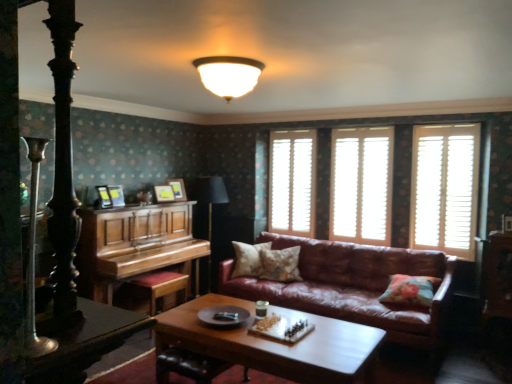
This screenshot has height=384, width=512. What do you see at coordinates (276, 343) in the screenshot?
I see `wooden chessboard at center` at bounding box center [276, 343].

The image size is (512, 384). What do you see at coordinates (410, 290) in the screenshot?
I see `floral fabric cushion at right, which is the 1th pillow from front to back` at bounding box center [410, 290].

What is the approximate width of fluffy beige pillow at center, which ranks as the 2th pillow in right-to-left order?

The width of fluffy beige pillow at center, which ranks as the 2th pillow in right-to-left order, is 13.66 inches.

Where is `fluffy beige pillow at center, the second pillow when ordered from back to front`? This screenshot has width=512, height=384. fluffy beige pillow at center, the second pillow when ordered from back to front is located at coordinates (280, 264).

This screenshot has height=384, width=512. What do you see at coordinates (135, 246) in the screenshot? I see `polished wood piano at left` at bounding box center [135, 246].

Measure the distance between polished wood piano at left and camera.

The depth of polished wood piano at left is 11.79 feet.

Where is `white wooden shutters at center, the second window from the right`? white wooden shutters at center, the second window from the right is located at coordinates (361, 185).

Measure the distance between point (293, 180) and camera.

Point (293, 180) and camera are 5.38 meters apart from each other.

Identify the location of wooden chessboard at center. This screenshot has width=512, height=384. (276, 343).

Which is behind, white wooden shutters at right, the 3th window positioned from the back, or polished wood piano at left?

white wooden shutters at right, the 3th window positioned from the back, is behind.

Who is shorter, white wooden shutters at right, marked as the 1th window in a front-to-back arrangement, or polished wood piano at left?

Standing shorter between the two is polished wood piano at left.

Would you say white wooden shutters at right, the 3th window positioned from the back, is outside polished wood piano at left?

That's correct, white wooden shutters at right, the 3th window positioned from the back, is outside of polished wood piano at left.

Is white wooden shutters at right, which is the 3th window in left-to-right order, facing towards polished wood piano at left?

No, white wooden shutters at right, which is the 3th window in left-to-right order, does not turn towards polished wood piano at left.

Does polished wood piano at left have a greater width compared to wooden picture frame at upper center, which is the second picture frame from back to front?

Yes, polished wood piano at left is wider than wooden picture frame at upper center, which is the second picture frame from back to front.

Does polished wood piano at left turn towards wooden picture frame at upper center, arranged as the second picture frame when viewed from the left?

No, polished wood piano at left is not turned towards wooden picture frame at upper center, arranged as the second picture frame when viewed from the left.

Locate an element on the screen. The width and height of the screenshot is (512, 384). piano on the left of wooden picture frame at upper center, which is the second picture frame in front-to-back order is located at coordinates (135, 246).

From the image's perspective, which one is positioned higher, white wooden shutters at center, positioned as the second window in left-to-right order, or leather at center?

white wooden shutters at center, positioned as the second window in left-to-right order.

Does white wooden shutters at center, placed as the second window when sorted from front to back, have a larger size compared to leather at center?

Correct, white wooden shutters at center, placed as the second window when sorted from front to back, is larger in size than leather at center.

At what (x,y) coordinates should I click in order to perform the action: click on window that is the 2nd object located above the leather at center (from the image's perspective). Please return your answer as a coordinate pair (x, y). Looking at the image, I should click on (361, 185).

Is white wooden shutters at center, the second window from the right, positioned far away from leather at center?

Absolutely, white wooden shutters at center, the second window from the right, is distant from leather at center.

From the image's perspective, is wooden at left beneath wooden chessboard at center?

Incorrect, from the image's perspective, wooden at left is higher than wooden chessboard at center.

Measure the distance from wooden at left to wooden chessboard at center.

wooden at left and wooden chessboard at center are 1.40 meters apart.

Who is smaller, wooden at left or wooden chessboard at center?

wooden at left.

Can you confirm if fluffy beige pillow at center, which ranks as the 2th pillow in right-to-left order, is bigger than wooden picture frame at upper center, the first picture frame when ordered from right to left?

Yes.

Who is shorter, fluffy beige pillow at center, the second pillow positioned from the left, or wooden picture frame at upper center, positioned as the third picture frame in front-to-back order?

wooden picture frame at upper center, positioned as the third picture frame in front-to-back order, is shorter.

From a real-world perspective, is fluffy beige pillow at center, the second pillow positioned from the left, physically above wooden picture frame at upper center, positioned as the third picture frame in front-to-back order?

No, from a real-world perspective, fluffy beige pillow at center, the second pillow positioned from the left, is not over wooden picture frame at upper center, positioned as the third picture frame in front-to-back order

Does point (276, 275) lie behind point (180, 200)?

That is False.

Is black fabric lamp at center wider than leather couch at center?

No.

Is black fabric lamp at center outside of leather couch at center?

black fabric lamp at center lies outside leather couch at center's area.

Is black fabric lamp at center oriented away from leather couch at center?

No, black fabric lamp at center is not facing the opposite direction of leather couch at center.

Would you say black fabric lamp at center is to the left or to the right of leather couch at center in the picture?

Clearly, black fabric lamp at center is on the left of leather couch at center in the image.

Is there a large distance between wooden picture frame at upper center, which ranks as the 2th picture frame in right-to-left order, and floral fabric pillow at center, which is counted as the third pillow, starting from the right?

wooden picture frame at upper center, which ranks as the 2th picture frame in right-to-left order, is far away from floral fabric pillow at center, which is counted as the third pillow, starting from the right.

In the scene shown: From a real-world perspective, which is physically below, wooden picture frame at upper center, which is the second picture frame from back to front, or floral fabric pillow at center, which is the third pillow from front to back?

From a 3D spatial view, floral fabric pillow at center, which is the third pillow from front to back, is below.

From the image's perspective, relative to floral fabric pillow at center, the 1th pillow when ordered from left to right, is wooden picture frame at upper center, which ranks as the 2th picture frame in right-to-left order, above or below?

Clearly, from the image's perspective, wooden picture frame at upper center, which ranks as the 2th picture frame in right-to-left order, is above floral fabric pillow at center, the 1th pillow when ordered from left to right.

From a real-world perspective, starting from the polished wood piano at left, which window is the 1st one vertically above it? Please provide its 2D coordinates.

[(445, 188)]

This screenshot has height=384, width=512. Find the location of `the 2nd picture frame behind when counting from the polished wood piano at left`. the 2nd picture frame behind when counting from the polished wood piano at left is located at coordinates (164, 193).

Based on their spatial positions, is wooden picture frame at upper center, which is the second picture frame from back to front, or wooden chessboard at center further from fluffy beige pillow at center, which ranks as the 2th pillow in right-to-left order?

The object further to fluffy beige pillow at center, which ranks as the 2th pillow in right-to-left order, is wooden chessboard at center.

Based on their spatial positions, is wooden picture frame at upper center, which is the second picture frame from back to front, or leather at center further from floral fabric cushion at right, the 1th pillow when ordered from right to left?

wooden picture frame at upper center, which is the second picture frame from back to front, is further to floral fabric cushion at right, the 1th pillow when ordered from right to left.

Looking at the image, which one is located closer to leather at center, floral fabric cushion at right, which is the 1th pillow from front to back, or white wooden shutters at center, the third window from the front?

floral fabric cushion at right, which is the 1th pillow from front to back.

Which object lies further to the anchor point white wooden shutters at center, the 3th window positioned from the right, wooden chessboard at center or wooden picture frame at upper center, which is the second picture frame from back to front?

Based on the image, wooden chessboard at center appears to be further to white wooden shutters at center, the 3th window positioned from the right.

From the image, which object appears to be farther from floral fabric pillow at center, which is counted as the third pillow, starting from the right, fluffy beige pillow at center, which ranks as the 2th pillow in right-to-left order, or floral fabric cushion at right, which ranks as the third pillow in back-to-front order?

floral fabric cushion at right, which ranks as the third pillow in back-to-front order, lies further to floral fabric pillow at center, which is counted as the third pillow, starting from the right, than the other object.

Considering their positions, is wooden at left positioned closer to wooden picture frame at upper center, the 3th picture frame from the left, than wooden chessboard at center?

wooden at left is closer to wooden picture frame at upper center, the 3th picture frame from the left.

Looking at this image, looking at the image, which one is located further to white frosted glass ceiling light at upper center, black fabric lamp at center or fluffy beige pillow at center, acting as the 2th pillow starting from the front?

black fabric lamp at center is positioned further to the anchor white frosted glass ceiling light at upper center.

Considering their positions, is fluffy beige pillow at center, the second pillow positioned from the left, positioned closer to leather couch at center than wooden picture frame at upper center, which is the first picture frame from back to front?

fluffy beige pillow at center, the second pillow positioned from the left, lies closer to leather couch at center than the other object.

The height and width of the screenshot is (384, 512). Find the location of `footrest between shiny black table at lower left and fluffy beige pillow at center, the second pillow positioned from the left, in the front-back direction`. footrest between shiny black table at lower left and fluffy beige pillow at center, the second pillow positioned from the left, in the front-back direction is located at coordinates (159, 288).

Where is `lamp situated between wooden at left and floral fabric cushion at right, which is the 3th pillow in left-to-right order, from left to right`? The width and height of the screenshot is (512, 384). lamp situated between wooden at left and floral fabric cushion at right, which is the 3th pillow in left-to-right order, from left to right is located at coordinates (228, 75).

Image resolution: width=512 pixels, height=384 pixels. I want to click on picture frame located between shiny black table at lower left and wooden picture frame at upper center, arranged as the second picture frame when viewed from the left, in the depth direction, so click(x=103, y=196).

Find the location of `picture frame between wooden chessboard at center and wooden picture frame at upper center, which is the second picture frame from back to front, along the z-axis`. picture frame between wooden chessboard at center and wooden picture frame at upper center, which is the second picture frame from back to front, along the z-axis is located at coordinates tap(103, 196).